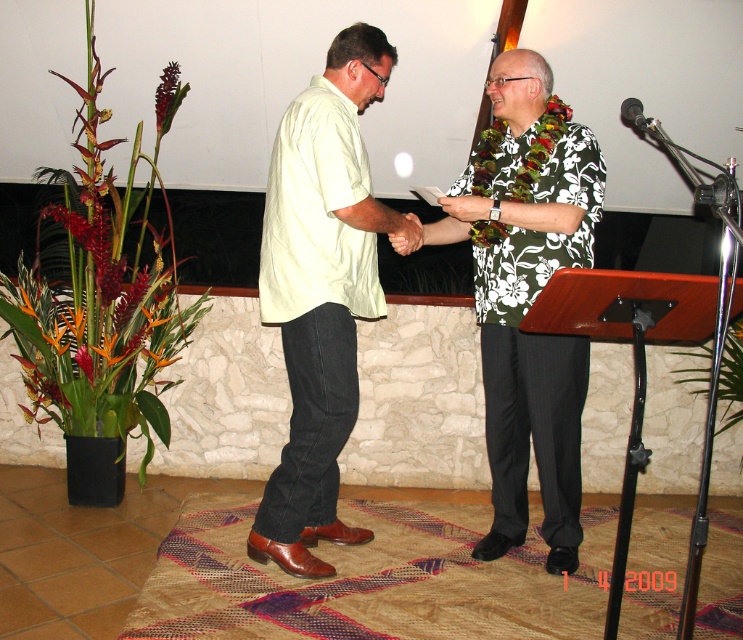
Is point (557, 342) farther from viewer compared to point (640, 116)?

Yes, point (557, 342) is farther from viewer.

Between floral print shirt at center and metallic silver microphone at upper right, which one appears on the left side from the viewer's perspective?

floral print shirt at center is more to the left.

At what (x,y) coordinates should I click in order to perform the action: click on floral print shirt at center. Please return your answer as a coordinate pair (x, y). Image resolution: width=743 pixels, height=640 pixels. Looking at the image, I should click on (x=528, y=294).

Image resolution: width=743 pixels, height=640 pixels. Identify the location of floral print shirt at center. click(528, 294).

Who is taller, floral print shirt at center or brown leather hand at center?

Standing taller between the two is floral print shirt at center.

What do you see at coordinates (528, 294) in the screenshot? I see `floral print shirt at center` at bounding box center [528, 294].

The image size is (743, 640). Describe the element at coordinates (528, 294) in the screenshot. I see `floral print shirt at center` at that location.

This screenshot has height=640, width=743. What are the coordinates of `floral print shirt at center` in the screenshot? It's located at (528, 294).

Does light beige cotton shirt at center have a greater width compared to brown leather hand at center?

Correct, the width of light beige cotton shirt at center exceeds that of brown leather hand at center.

Is light beige cotton shirt at center shorter than brown leather hand at center?

In fact, light beige cotton shirt at center may be taller than brown leather hand at center.

The height and width of the screenshot is (640, 743). In order to click on light beige cotton shirt at center in this screenshot , I will do tap(319, 292).